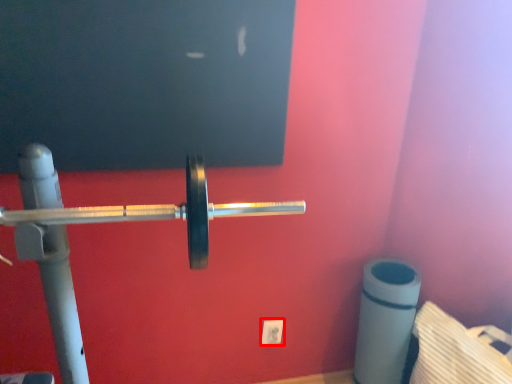
Question: Where is power plugs and sockets (annotated by the red box) located in relation to barbell in the image?

Choices:
 (A) left
 (B) right

Answer: (B)